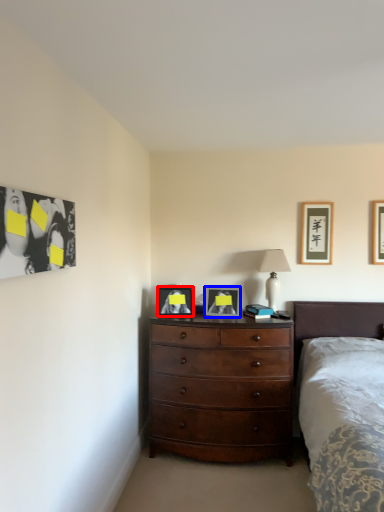
Question: Which object is closer to the camera taking this photo, picture frame (highlighted by a red box) or picture frame (highlighted by a blue box)?

Choices:
 (A) picture frame
 (B) picture frame

Answer: (B)